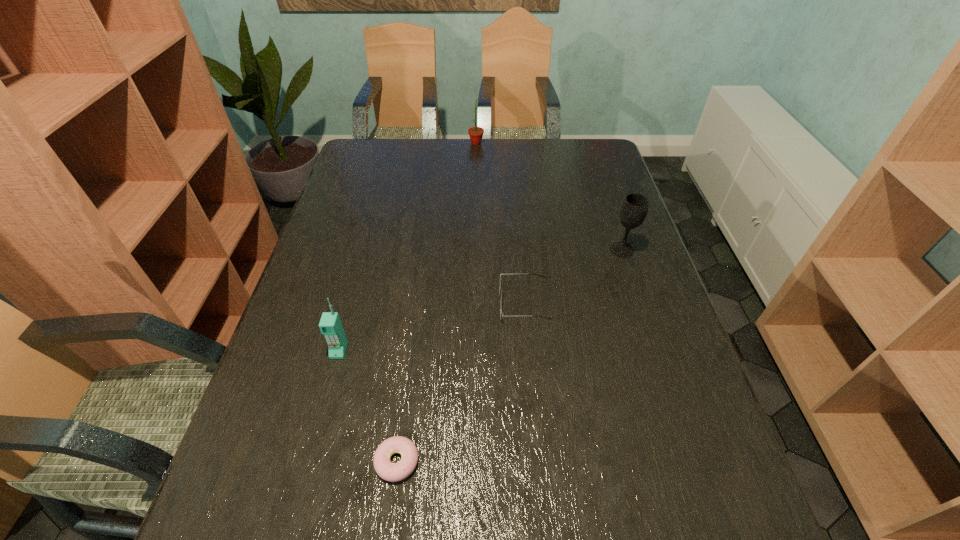
You are a GUI agent. You are given a task and a screenshot of the screen. Output one action in this format:
    pyautogui.click(x=<x>, y=<y>)
    Task: Click on the free space that satisfies the following two spatial constraints: 1. on the face of the third object from right to left; 2. on the left side of the fourth nearest object
    
    Given the screenshot: What is the action you would take?
    pyautogui.click(x=475, y=249)

Find the location of a particular element. The image size is (960, 540). free spot that satisfies the following two spatial constraints: 1. on the front side of the fourth nearest object; 2. on the front-facing side of the fourth object from left to right is located at coordinates (639, 303).

What are the coordinates of `free location that satisfies the following two spatial constraints: 1. on the face of the third object from left to right; 2. on the back side of the rightmost object` in the screenshot? It's located at (x=475, y=249).